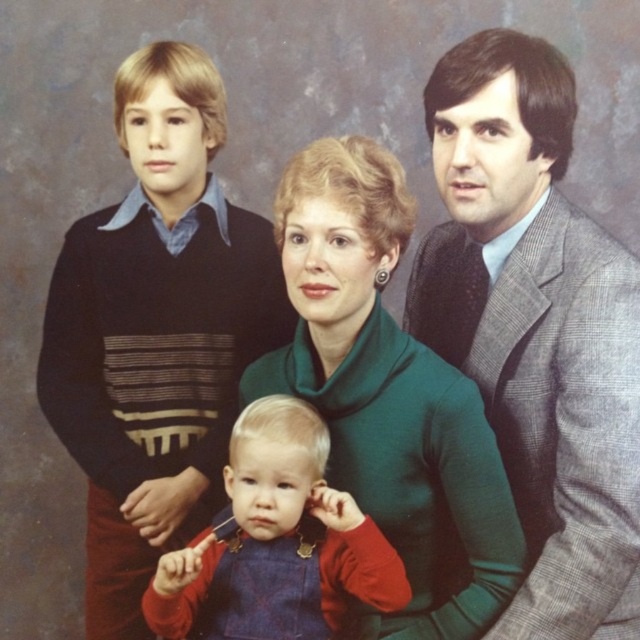
How far apart are green woolen sweater at center and red velvet overalls at center?

The distance of green woolen sweater at center from red velvet overalls at center is 6.65 inches.

Does green woolen sweater at center come in front of red velvet overalls at center?

No.

Who is more forward, [378,316] or [182,572]?

Positioned in front is point [182,572].

I want to click on green woolen sweater at center, so click(388, 396).

Who is more forward, (467, 276) or (467, 538)?

Point (467, 538) is more forward.

Between gray textured suit at right and green woolen sweater at center, which one appears on the right side from the viewer's perspective?

gray textured suit at right

Which is in front, point (506, 364) or point (502, 490)?

Point (502, 490) is in front.

This screenshot has width=640, height=640. Find the location of `gray textured suit at right`. gray textured suit at right is located at coordinates (536, 328).

Is gray textured suit at right taller than red velvet overalls at center?

Yes.

Between gray textured suit at right and red velvet overalls at center, which one has less height?

red velvet overalls at center is shorter.

Measure the distance between gray textured suit at right and camera.

gray textured suit at right and camera are 3.79 feet apart from each other.

Find the location of a particular element. This screenshot has width=640, height=640. gray textured suit at right is located at coordinates (536, 328).